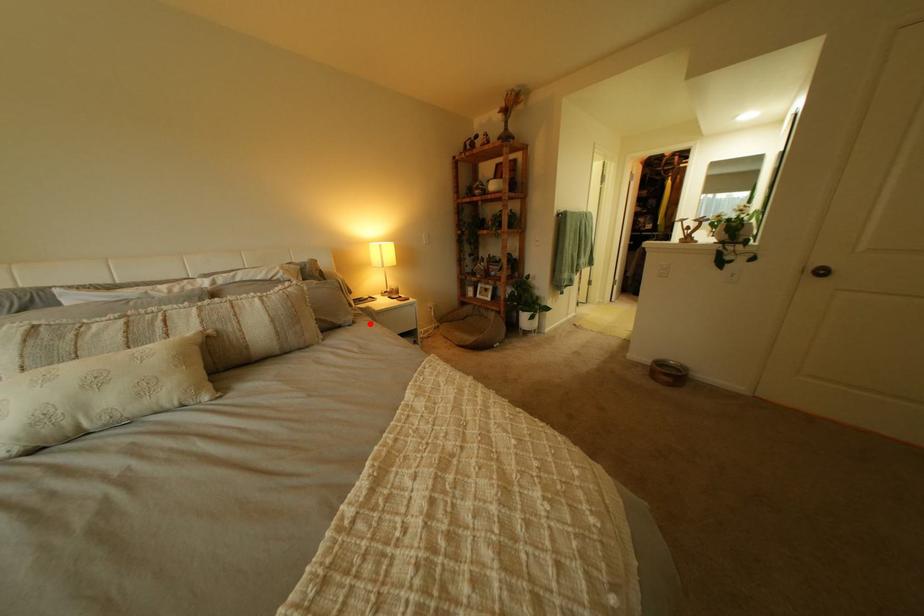
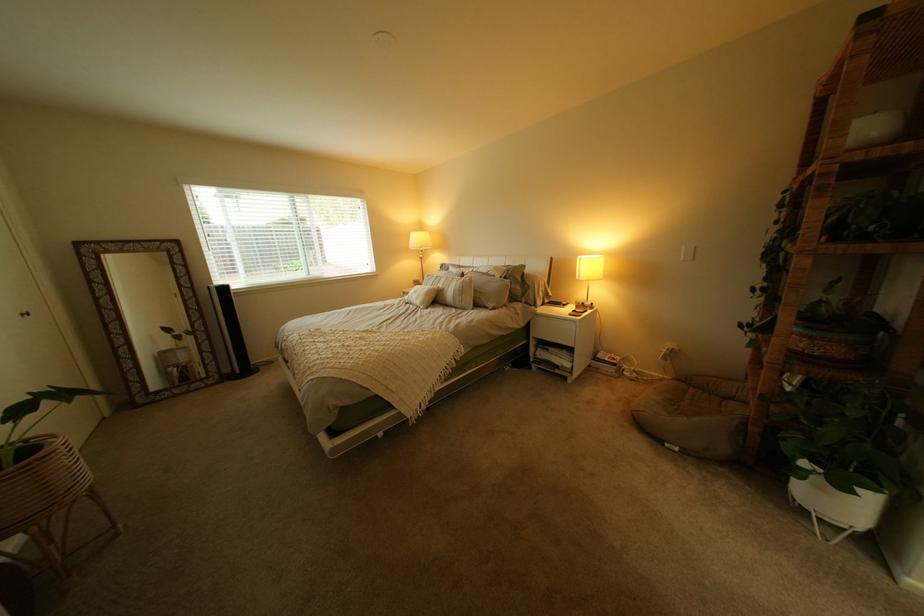
Where in the second image is the point corresponding to the highlighted location from the first image?

(509, 310)